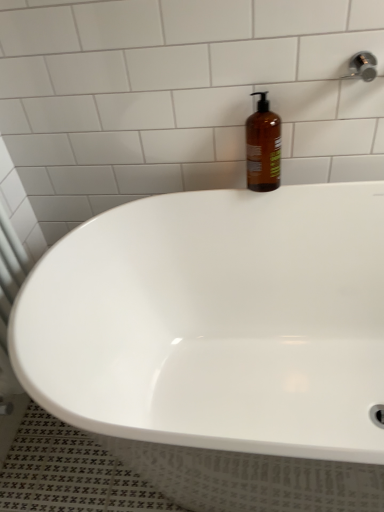
Measure the distance between point (52,253) and camera.

Point (52,253) is 1.02 meters away from camera.

The height and width of the screenshot is (512, 384). Describe the element at coordinates (220, 342) in the screenshot. I see `white glossy bathtub at center` at that location.

This screenshot has height=512, width=384. I want to click on white glossy bathtub at center, so click(x=220, y=342).

Identify the location of amber glass bottle at upper right. (263, 147).

In order to face amber glass bottle at upper right, should I rotate leftwards or rightwards?

It's best to rotate right around 9.735 degrees.

This screenshot has width=384, height=512. What do you see at coordinates (263, 147) in the screenshot?
I see `amber glass bottle at upper right` at bounding box center [263, 147].

Where is `white glossy bathtub at center`? The width and height of the screenshot is (384, 512). white glossy bathtub at center is located at coordinates (220, 342).

Can you confirm if white glossy bathtub at center is positioned to the right of amber glass bottle at upper right?

Incorrect, white glossy bathtub at center is not on the right side of amber glass bottle at upper right.

Consider the image. Who is more distant, white glossy bathtub at center or amber glass bottle at upper right?

amber glass bottle at upper right is behind.

Considering the points (305, 246) and (271, 189), which point is in front, point (305, 246) or point (271, 189)?

Point (271, 189)

From the image's perspective, is white glossy bathtub at center above or below amber glass bottle at upper right?

white glossy bathtub at center is below amber glass bottle at upper right.

From a real-world perspective, between white glossy bathtub at center and amber glass bottle at upper right, who is vertically higher?

Result: From a 3D spatial view, amber glass bottle at upper right is above.

Which object is wider, white glossy bathtub at center or amber glass bottle at upper right?

white glossy bathtub at center is wider.

Considering the relative sizes of white glossy bathtub at center and amber glass bottle at upper right in the image provided, is white glossy bathtub at center taller than amber glass bottle at upper right?

Yes, white glossy bathtub at center is taller than amber glass bottle at upper right.

Which of these two, white glossy bathtub at center or amber glass bottle at upper right, is smaller?

amber glass bottle at upper right.

Do you think white glossy bathtub at center is within amber glass bottle at upper right, or outside of it?

white glossy bathtub at center is not inside amber glass bottle at upper right, it's outside.

Is white glossy bathtub at center next to amber glass bottle at upper right?

There is a gap between white glossy bathtub at center and amber glass bottle at upper right.

Is white glossy bathtub at center positioned with its back to amber glass bottle at upper right?

No.

How different are the orientations of white glossy bathtub at center and amber glass bottle at upper right in degrees?

white glossy bathtub at center and amber glass bottle at upper right are facing 0.916 degrees away from each other.

Image resolution: width=384 pixels, height=512 pixels. Find the location of `bottle above the white glossy bathtub at center (from a real-world perspective)`. bottle above the white glossy bathtub at center (from a real-world perspective) is located at coordinates (263, 147).

Does amber glass bottle at upper right appear on the left side of white glossy bathtub at center?

No, amber glass bottle at upper right is not to the left of white glossy bathtub at center.

Consider the image. Considering their positions, is amber glass bottle at upper right located in front of or behind white glossy bathtub at center?

amber glass bottle at upper right is behind white glossy bathtub at center.

Which point is more distant from viewer, [261,132] or [168,333]?

Point [168,333]

From the image's perspective, is amber glass bottle at upper right positioned above or below white glossy bathtub at center?

From the image's perspective, amber glass bottle at upper right appears above white glossy bathtub at center.

From a real-world perspective, between amber glass bottle at upper right and white glossy bathtub at center, who is vertically lower?

white glossy bathtub at center, from a real-world perspective.

Considering the sizes of objects amber glass bottle at upper right and white glossy bathtub at center in the image provided, who is wider, amber glass bottle at upper right or white glossy bathtub at center?

→ white glossy bathtub at center.

Does amber glass bottle at upper right have a lesser height compared to white glossy bathtub at center?

Yes.

Considering the sizes of objects amber glass bottle at upper right and white glossy bathtub at center in the image provided, who is smaller, amber glass bottle at upper right or white glossy bathtub at center?

amber glass bottle at upper right.

Would you say amber glass bottle at upper right contains white glossy bathtub at center?

No, white glossy bathtub at center is located outside of amber glass bottle at upper right.

Is amber glass bottle at upper right far away from white glossy bathtub at center?

No, amber glass bottle at upper right is not far away from white glossy bathtub at center.

Is amber glass bottle at upper right oriented away from white glossy bathtub at center?

That's not correct — amber glass bottle at upper right is not looking away from white glossy bathtub at center.

Can you tell me how much amber glass bottle at upper right and white glossy bathtub at center differ in facing direction?

The facing directions of amber glass bottle at upper right and white glossy bathtub at center are 0.916 degrees apart.

How distant is amber glass bottle at upper right from white glossy bathtub at center?

amber glass bottle at upper right and white glossy bathtub at center are 17.86 inches apart from each other.

At what (x,y) coordinates should I click in order to perform the action: click on bottle that is above the white glossy bathtub at center (from a real-world perspective). Please return your answer as a coordinate pair (x, y). Looking at the image, I should click on (263, 147).

The image size is (384, 512). I want to click on bathtub lying below the amber glass bottle at upper right (from the image's perspective), so click(220, 342).

Where is `bottle located behind the white glossy bathtub at center`? This screenshot has width=384, height=512. bottle located behind the white glossy bathtub at center is located at coordinates (263, 147).